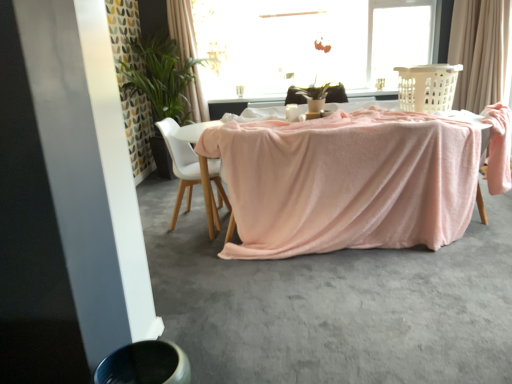
Find the location of `vacant area that is in front of white matte chair at center`. vacant area that is in front of white matte chair at center is located at coordinates (187, 246).